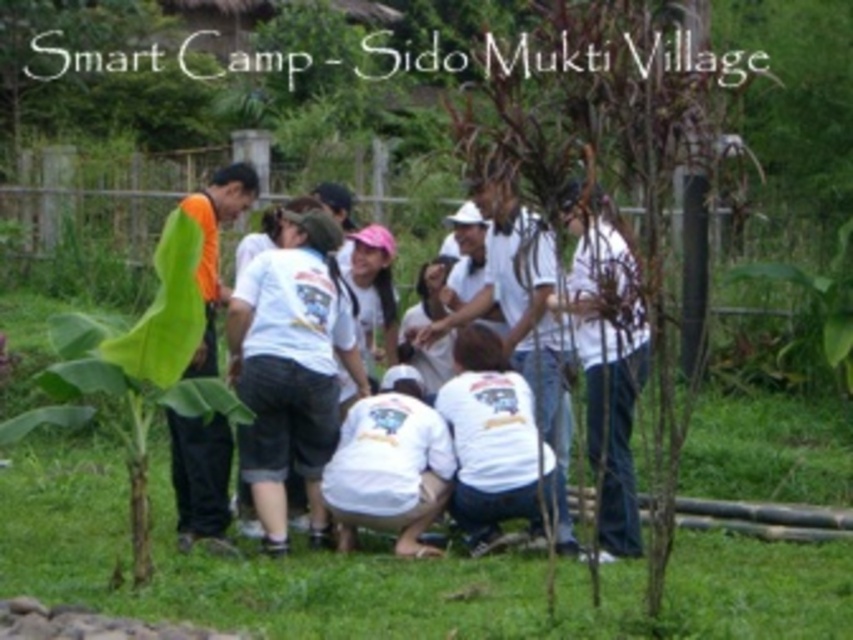
Question: Which object appears farthest from the camera in this image?

Choices:
 (A) orange fabric shirt at left
 (B) white cotton shirt at center

Answer: (A)

Question: From the image, what is the correct spatial relationship of white cotton shirt at center in relation to green leafy banana tree at left?

Choices:
 (A) left
 (B) right

Answer: (B)

Question: From the image, what is the correct spatial relationship of white cotton shirt at center in relation to orange fabric shirt at left?

Choices:
 (A) below
 (B) above

Answer: (A)

Question: Which of these objects is positioned farthest from the white cotton shirt at center?

Choices:
 (A) orange fabric shirt at left
 (B) green leafy banana tree at left

Answer: (B)

Question: Which object appears closest to the camera in this image?

Choices:
 (A) green leafy banana tree at left
 (B) orange fabric shirt at left
 (C) white cotton shirt at center

Answer: (A)

Question: Is green leafy banana tree at left above orange fabric shirt at left?

Choices:
 (A) no
 (B) yes

Answer: (A)